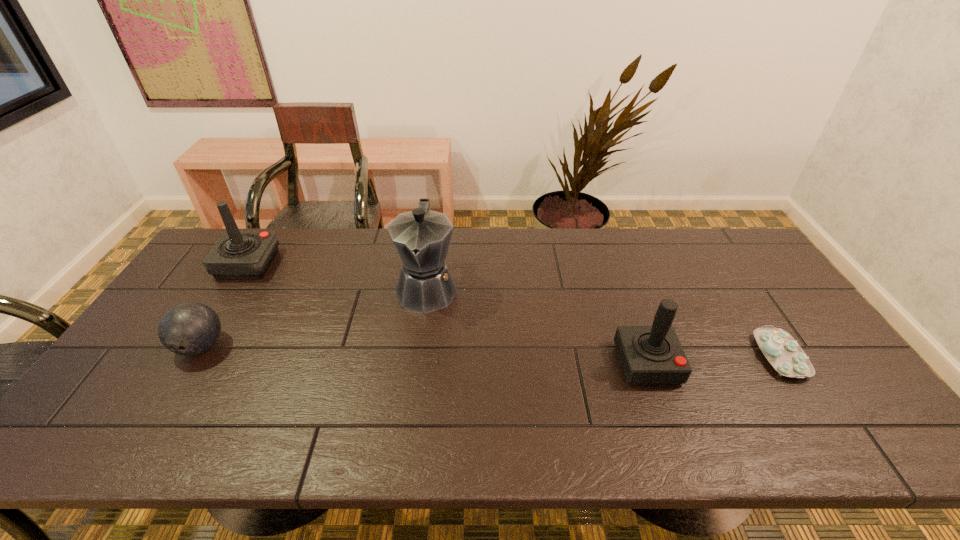
Where is `blank region between the nearer joystick and the second shortest object`? This screenshot has height=540, width=960. blank region between the nearer joystick and the second shortest object is located at coordinates (424, 355).

This screenshot has width=960, height=540. I want to click on unoccupied area between the nearer joystick and the coffeepot, so click(x=538, y=326).

The height and width of the screenshot is (540, 960). I want to click on vacant region between the farther joystick and the tallest object, so click(x=338, y=276).

Where is `object that is the closest one to the shortest object`? object that is the closest one to the shortest object is located at coordinates (653, 354).

This screenshot has height=540, width=960. In order to click on the second closest object to the right joystick in this screenshot , I will do `click(422, 237)`.

At what (x,y) coordinates should I click in order to perform the action: click on vacant space that satisfies the following two spatial constraints: 1. at the spout of the shortest object; 2. on the right side of the coffeepot. Please return your answer as a coordinate pair (x, y). Looking at the image, I should click on (419, 356).

Identify the location of free space that satisfies the following two spatial constraints: 1. at the spout of the chinaware; 2. on the left side of the third object from right to left. The height and width of the screenshot is (540, 960). (419, 356).

Identify the location of free space that satisfies the following two spatial constraints: 1. at the spout of the coffeepot; 2. on the right side of the chinaware. This screenshot has width=960, height=540. (419, 356).